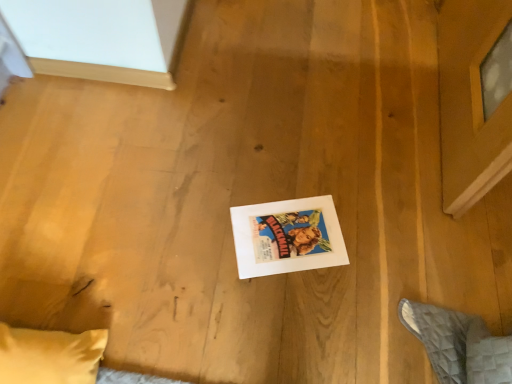
Describe the element at coordinates (287, 236) in the screenshot. I see `white paper at center` at that location.

Locate an element on the screen. white paper at center is located at coordinates (287, 236).

At what (x,y) coordinates should I click in order to perform the action: click on white paper at center. Please return your answer as a coordinate pair (x, y). This screenshot has width=512, height=384. Looking at the image, I should click on (287, 236).